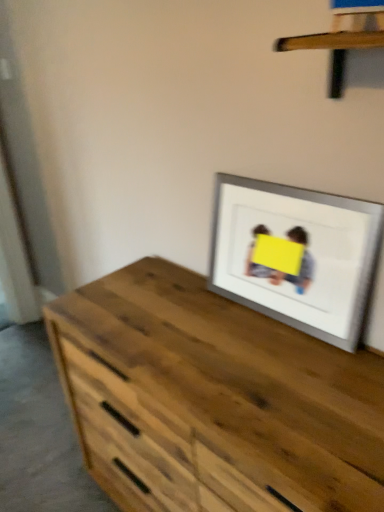
Question: Is wooden at upper center beside wooden chest of drawers at center?

Choices:
 (A) yes
 (B) no

Answer: (B)

Question: From a real-world perspective, is wooden at upper center on top of wooden chest of drawers at center?

Choices:
 (A) no
 (B) yes

Answer: (B)

Question: Considering the relative sizes of wooden at upper center and wooden chest of drawers at center in the image provided, is wooden at upper center taller than wooden chest of drawers at center?

Choices:
 (A) no
 (B) yes

Answer: (A)

Question: Can you confirm if wooden at upper center is thinner than wooden chest of drawers at center?

Choices:
 (A) yes
 (B) no

Answer: (A)

Question: Considering the relative sizes of wooden at upper center and wooden chest of drawers at center in the image provided, is wooden at upper center wider than wooden chest of drawers at center?

Choices:
 (A) yes
 (B) no

Answer: (B)

Question: Is wooden at upper center shorter than wooden chest of drawers at center?

Choices:
 (A) yes
 (B) no

Answer: (A)

Question: Can you confirm if wooden chest of drawers at center is thinner than wooden at upper center?

Choices:
 (A) yes
 (B) no

Answer: (B)

Question: Considering the relative positions of wooden chest of drawers at center and wooden at upper center in the image provided, is wooden chest of drawers at center to the right of wooden at upper center from the viewer's perspective?

Choices:
 (A) yes
 (B) no

Answer: (B)

Question: From a real-world perspective, is wooden chest of drawers at center beneath wooden at upper center?

Choices:
 (A) yes
 (B) no

Answer: (A)

Question: From a real-world perspective, is wooden chest of drawers at center on wooden at upper center?

Choices:
 (A) no
 (B) yes

Answer: (A)

Question: Can you confirm if wooden chest of drawers at center is shorter than wooden at upper center?

Choices:
 (A) yes
 (B) no

Answer: (B)

Question: Would you say wooden chest of drawers at center contains wooden at upper center?

Choices:
 (A) no
 (B) yes

Answer: (A)

Question: Is silver/metallic picture frame at upper right positioned in front of wooden at upper center?

Choices:
 (A) no
 (B) yes

Answer: (A)